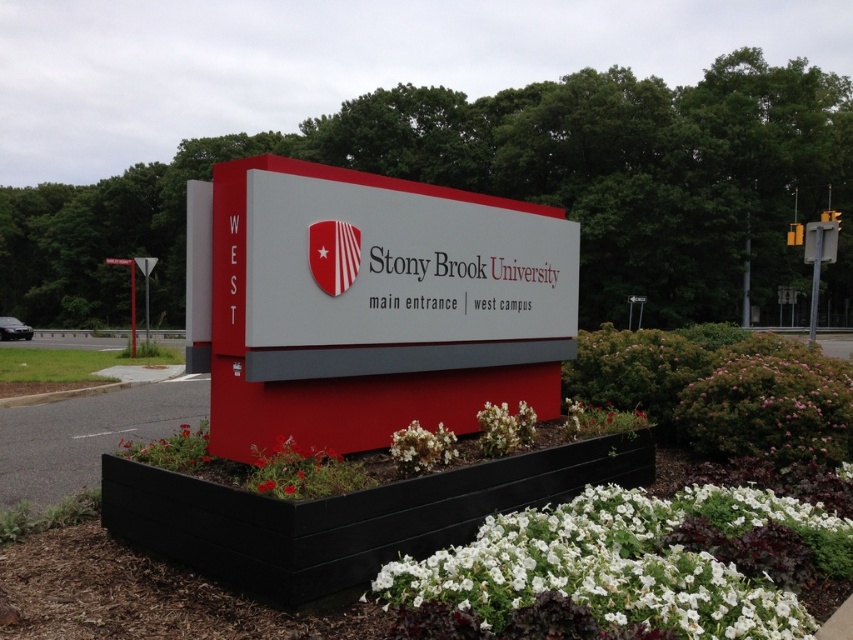
Question: Which object is the closest to the white matte flower at center?

Choices:
 (A) white matte petal at lower center
 (B) pink matte bush at lower right
 (C) white matte flower at lower center

Answer: (C)

Question: Among these objects, which one is farthest from the camera?

Choices:
 (A) white matte flower at lower center
 (B) white matte flower at center
 (C) pink matte bush at lower right

Answer: (C)

Question: Considering the relative positions of white matte petal at lower center and white matte flower at center in the image provided, where is white matte petal at lower center located with respect to white matte flower at center?

Choices:
 (A) above
 (B) below

Answer: (B)

Question: Can you confirm if pink matte bush at lower right is positioned to the right of white matte flower at lower center?

Choices:
 (A) no
 (B) yes

Answer: (B)

Question: Estimate the real-world distances between objects in this image. Which object is farther from the pink matte bush at lower right?

Choices:
 (A) white matte petal at lower center
 (B) white matte flower at lower center

Answer: (B)

Question: Does white matte petal at lower center have a lesser width compared to white matte flower at center?

Choices:
 (A) no
 (B) yes

Answer: (A)